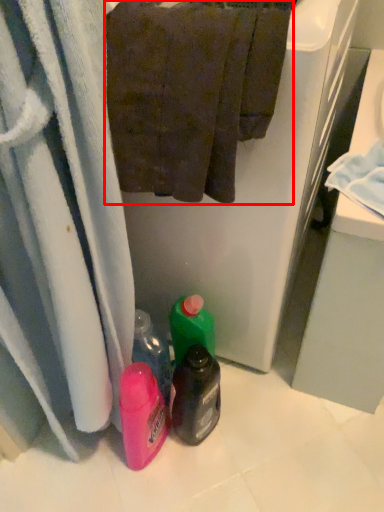
Question: Observing the image, what is the correct spatial positioning of towel (annotated by the red box) in reference to bottle?

Choices:
 (A) left
 (B) right

Answer: (A)